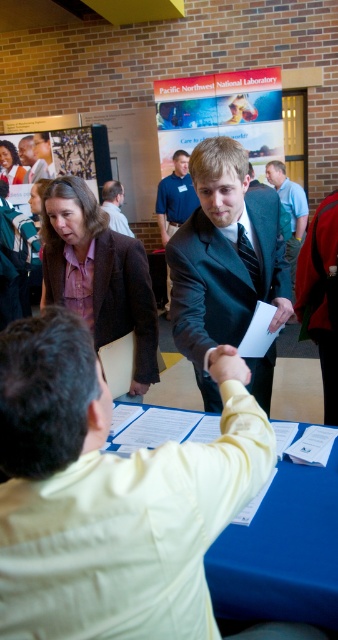
Question: Does matte white banner at upper center have a smaller size compared to matte plastic poster at upper left?

Choices:
 (A) no
 (B) yes

Answer: (A)

Question: Among these points, which one is farthest from the camera?

Choices:
 (A) (113, 204)
 (B) (189, 170)
 (C) (100, 600)

Answer: (A)

Question: Estimate the real-world distances between objects in this image. Which object is closer to the dark blue suit at center?

Choices:
 (A) matte purple shirt at center
 (B) blue denim shirt at center
 (C) matte brown suit at center
 (D) matte black suit at center

Answer: (C)

Question: From the image, what is the correct spatial relationship of matte white banner at upper center in relation to matte plastic poster at upper left?

Choices:
 (A) left
 (B) right

Answer: (B)

Question: Considering the real-world distances, which object is closest to the matte black suit at center?

Choices:
 (A) blue denim shirt at center
 (B) shiny black suit at center

Answer: (A)

Question: Is shiny black suit at center further to camera compared to matte plastic poster at upper left?

Choices:
 (A) no
 (B) yes

Answer: (A)